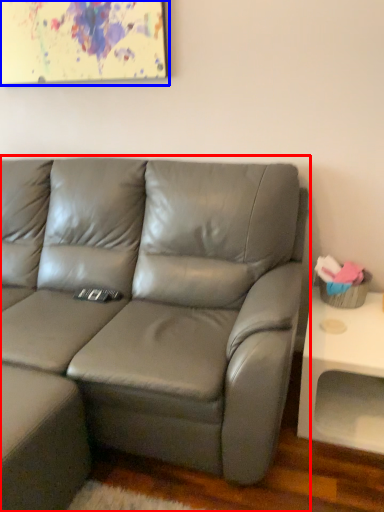
Question: Which object appears closest to the camera in this image, studio couch (highlighted by a red box) or picture frame (highlighted by a blue box)?

Choices:
 (A) studio couch
 (B) picture frame

Answer: (A)